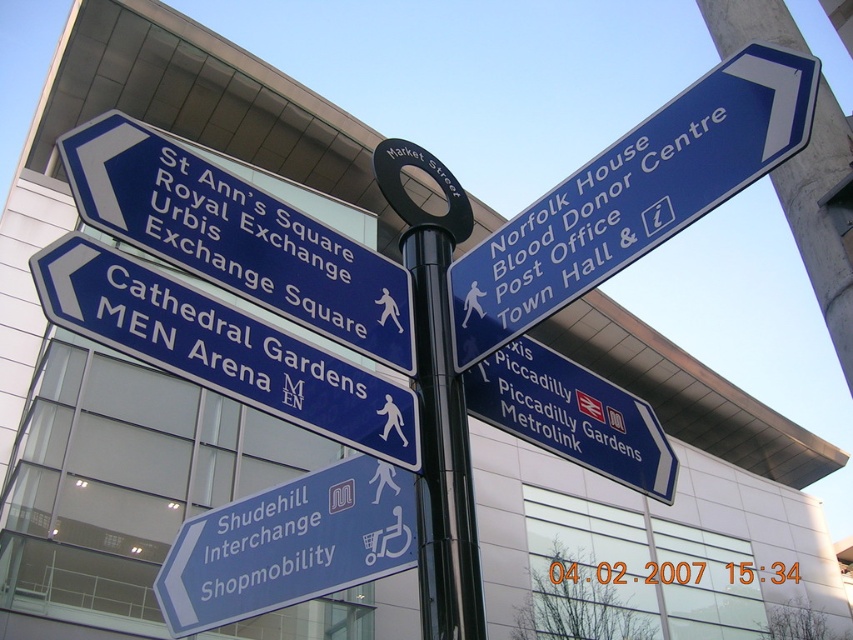
Question: Does blue plastic sign at upper left have a greater width compared to blue metallic sign at right?

Choices:
 (A) yes
 (B) no

Answer: (A)

Question: Does blue plastic sign at upper left have a larger size compared to blue plastic sign at lower left?

Choices:
 (A) yes
 (B) no

Answer: (A)

Question: Is blue plastic sign at upper left in front of blue metallic sign at center-left?

Choices:
 (A) no
 (B) yes

Answer: (A)

Question: Estimate the real-world distances between objects in this image. Which object is closer to the blue plastic sign at lower left?

Choices:
 (A) blue metallic sign at right
 (B) blue plastic sign at upper right
 (C) blue metallic sign at center-left

Answer: (C)

Question: Among these points, which one is farthest from the camera?

Choices:
 (A) (79, 180)
 (B) (450, 285)
 (C) (505, 412)
 (D) (408, 538)

Answer: (B)

Question: Which of the following is the closest to the observer?

Choices:
 (A) (723, 195)
 (B) (525, 369)
 (C) (83, 198)

Answer: (C)